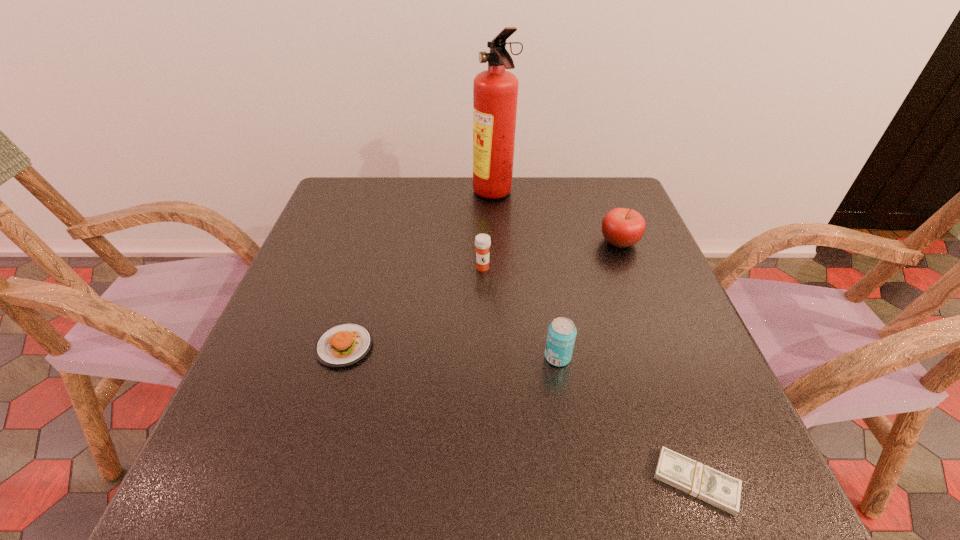
Find the location of a particular element. The height and width of the screenshot is (540, 960). free spot between the second shortest object and the tallest object is located at coordinates (420, 271).

Where is `vacant area that lies between the medicine and the farthest object`? Image resolution: width=960 pixels, height=540 pixels. vacant area that lies between the medicine and the farthest object is located at coordinates click(489, 231).

The width and height of the screenshot is (960, 540). What are the coordinates of `free spot between the fifth nearest object and the leftmost object` in the screenshot? It's located at (482, 294).

This screenshot has height=540, width=960. I want to click on free spot between the shortest object and the fourth object from left to right, so click(627, 420).

Locate an element on the screen. The image size is (960, 540). vacant point located between the nearest object and the fifth tallest object is located at coordinates (520, 414).

Where is `free space between the leftmost object and the nearest object`? This screenshot has height=540, width=960. free space between the leftmost object and the nearest object is located at coordinates (520, 414).

The height and width of the screenshot is (540, 960). In order to click on free spot between the money and the third object from right to left in this screenshot , I will do `click(627, 420)`.

Find the location of a particular element. The height and width of the screenshot is (540, 960). vacant space in between the money and the beer can is located at coordinates (627, 420).

Locate an element on the screen. The height and width of the screenshot is (540, 960). vacant space that is in between the second farthest object and the money is located at coordinates (658, 362).

Find the location of a particular element. This screenshot has height=540, width=960. object that is the closest one to the fourth nearest object is located at coordinates click(x=495, y=91).